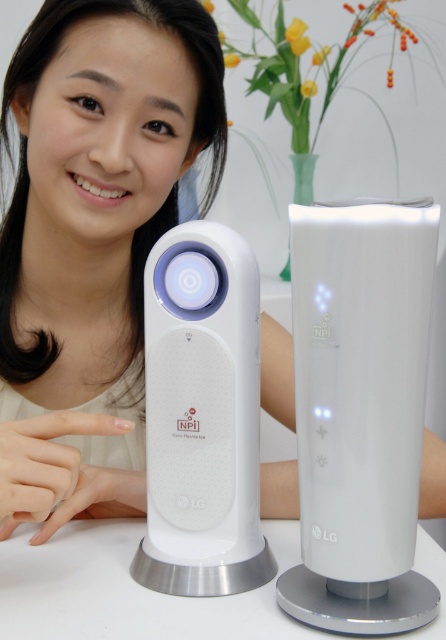
Does white glossy tower at center lie in front of white glossy speaker at center?

Yes, white glossy tower at center is in front of white glossy speaker at center.

Locate an element on the screen. white glossy tower at center is located at coordinates (359, 412).

This screenshot has width=446, height=640. I want to click on white glossy tower at center, so click(359, 412).

Is white glossy tower at center wider than white glossy table at center?

In fact, white glossy tower at center might be narrower than white glossy table at center.

Image resolution: width=446 pixels, height=640 pixels. I want to click on white glossy tower at center, so click(x=359, y=412).

Does white glossy speaker at center have a larger size compared to white glossy table at center?

Incorrect, white glossy speaker at center is not larger than white glossy table at center.

Who is lower down, white glossy speaker at center or white glossy table at center?

white glossy table at center is lower down.

Describe the element at coordinates (202, 417) in the screenshot. Image resolution: width=446 pixels, height=640 pixels. I see `white glossy speaker at center` at that location.

Where is `white glossy speaker at center`? The image size is (446, 640). white glossy speaker at center is located at coordinates (202, 417).